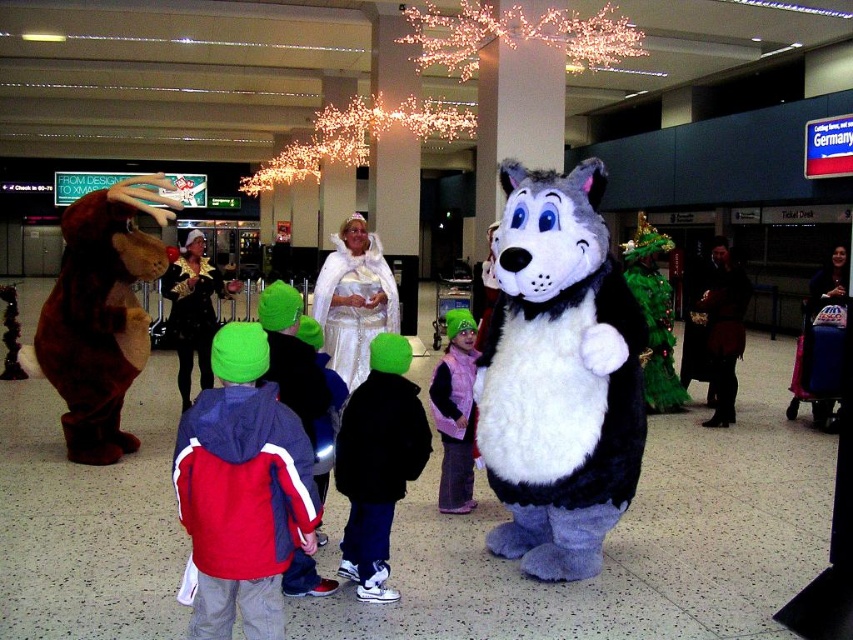
You are an airport security agent checking the width of the jackets and costumes to ensure they fit through the Xray machine. The Xray machine can only accommodate items up to 40 cm in width. You observe the red and blue jacket at center and the shiny gold costume at center. Which one is wider and will not fit through the Xray machine?

The red and blue jacket at center is wider than the shiny gold costume at center. Since the Xray machine can only accommodate items up to 40 cm, the red and blue jacket at center may not fit if its width exceeds 40 cm.

You are a photographer positioned at the back of the scene. You want to take a photo of both the shiny gold costume at center and the velvet purple coat at lower right without any obstruction. Which object should you move closer to the camera to ensure both are visible?

The velvet purple coat at lower right is behind the shiny gold costume at center. To ensure both are visible without obstruction, you should move the velvet purple coat at lower right forward so it is in front of the shiny gold costume at center.

You are standing at the point marked as point (x=200, y=538) in the image. The Christmas tree is located 10 feet behind you. Can you see the Christmas tree from your current position?

The Christmas tree is located 10 feet behind you, but you are 8.50 feet away from the viewer. Therefore, you cannot see the Christmas tree from your current position because it is behind you and farther than your distance from the viewer.